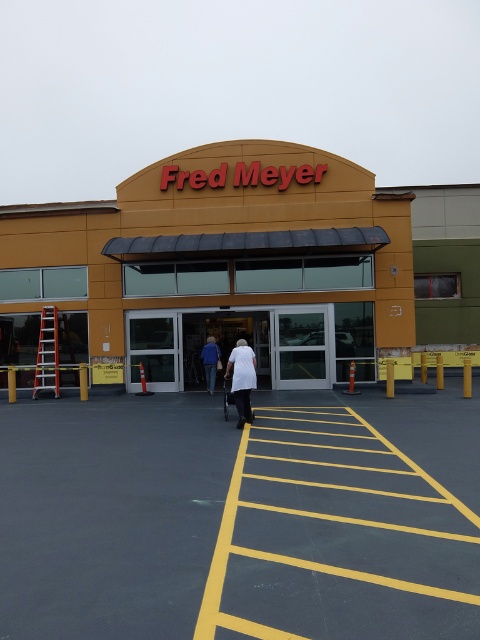
Which is in front, point (87, 426) or point (216, 346)?

Positioned in front is point (87, 426).

Is yellow asphalt at center taller than white matte jacket at center?

In fact, yellow asphalt at center may be shorter than white matte jacket at center.

Where is `yellow asphalt at center`? yellow asphalt at center is located at coordinates (240, 516).

Is yellow asphalt at center positioned behind yellow matte building at center?

No, yellow asphalt at center is closer to the viewer.

Can you confirm if yellow asphalt at center is wider than yellow matte building at center?

Incorrect, yellow asphalt at center's width does not surpass yellow matte building at center's.

The height and width of the screenshot is (640, 480). Find the location of `yellow asphalt at center`. yellow asphalt at center is located at coordinates (240, 516).

Is yellow matte building at center thinner than white matte jacket at center?

No.

Is yellow matte building at center to the right of white matte jacket at center from the viewer's perspective?

Yes, yellow matte building at center is to the right of white matte jacket at center.

Find the location of a particular element. yellow matte building at center is located at coordinates (245, 269).